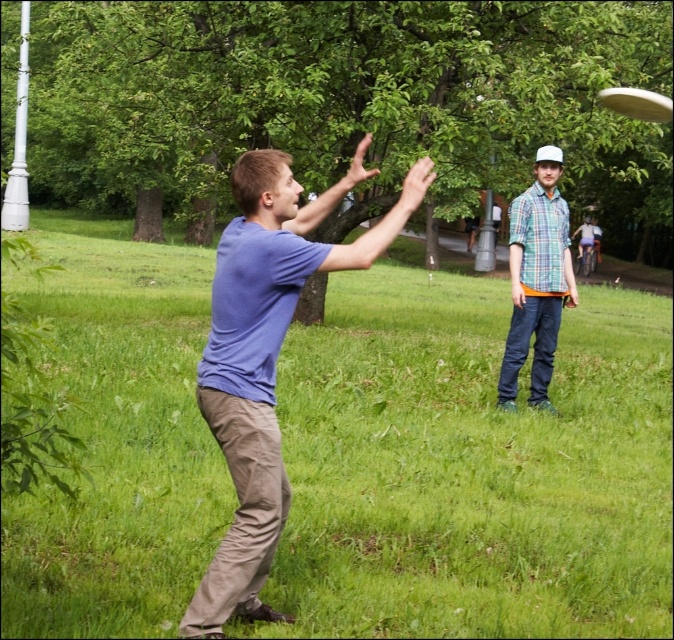
Consider the image. You are planning to buy a new shirt and want to know which one is more slim fit between the checkered fabric shirt at center and the checkered fabric shirt at upper right. Which one should you choose?

The checkered fabric shirt at center is thinner than the checkered fabric shirt at upper right, so you should choose the checkered fabric shirt at center for a slim fit.

You are planning to set up a picnic blanket in the park. The picnic blanket is 2 meters wide. Based on the scene, will the green grass at center and the checkered fabric shirt at center allow enough space for the blanket? Please explain using their widths.

The green grass at center is wider than the checkered fabric shirt at center. Since the picnic blanket is 2 meters wide, the green grass at center provides sufficient width for the blanket, but the checkered fabric shirt at center may be narrower. However, since the shirt is an object, it can be moved to accommodate the blanket.